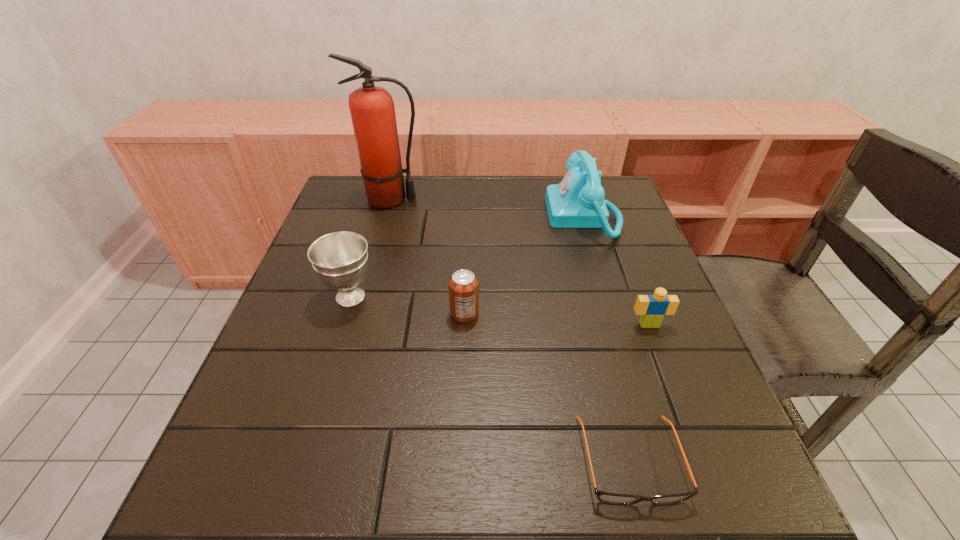
At what (x,y) coordinates should I click in order to perform the action: click on free space that is in between the tallest object and the shortest object. Please return your answer as a coordinate pair (x, y). Looking at the image, I should click on (511, 330).

Locate an element on the screen. The height and width of the screenshot is (540, 960). unoccupied position between the shortest object and the tallest object is located at coordinates (511, 330).

Select which object is the third closest to the Lego. Please provide its 2D coordinates. Your answer should be formatted as a tuple, i.e. [(x, y)], where the tuple contains the x and y coordinates of a point satisfying the conditions above.

[(463, 285)]

Select which object appears as the fifth closest to the nearest object. Please provide its 2D coordinates. Your answer should be formatted as a tuple, i.e. [(x, y)], where the tuple contains the x and y coordinates of a point satisfying the conditions above.

[(372, 110)]

What are the coordinates of `blank space that satisfies the following two spatial constraints: 1. on the back side of the fourth object from right to left; 2. on the nozzle of the tallest object` in the screenshot? It's located at click(x=468, y=200).

The width and height of the screenshot is (960, 540). Find the location of `free location that satisfies the following two spatial constraints: 1. on the back side of the can; 2. on the nozzle of the fire extinguisher`. free location that satisfies the following two spatial constraints: 1. on the back side of the can; 2. on the nozzle of the fire extinguisher is located at coordinates (468, 200).

Identify the location of blank space that satisfies the following two spatial constraints: 1. on the nozzle of the fire extinguisher; 2. on the front side of the chalice. (364, 296).

Identify the location of vacant area that satisfies the following two spatial constraints: 1. on the dial of the telephone; 2. on the front-facing side of the spectacles. This screenshot has height=540, width=960. (659, 460).